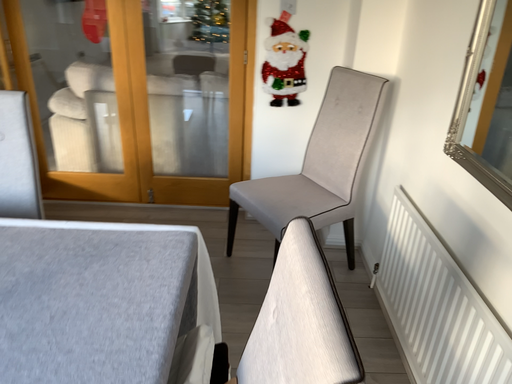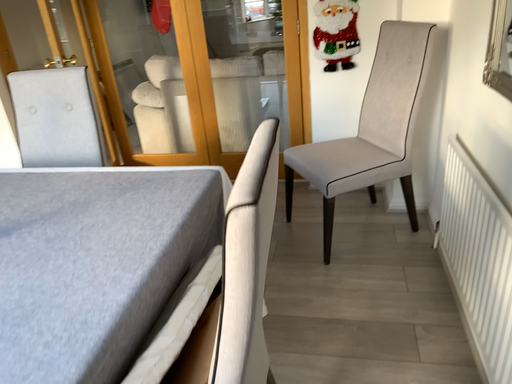
Question: How did the camera likely rotate when shooting the video?

Choices:
 (A) rotated right
 (B) rotated left

Answer: (B)